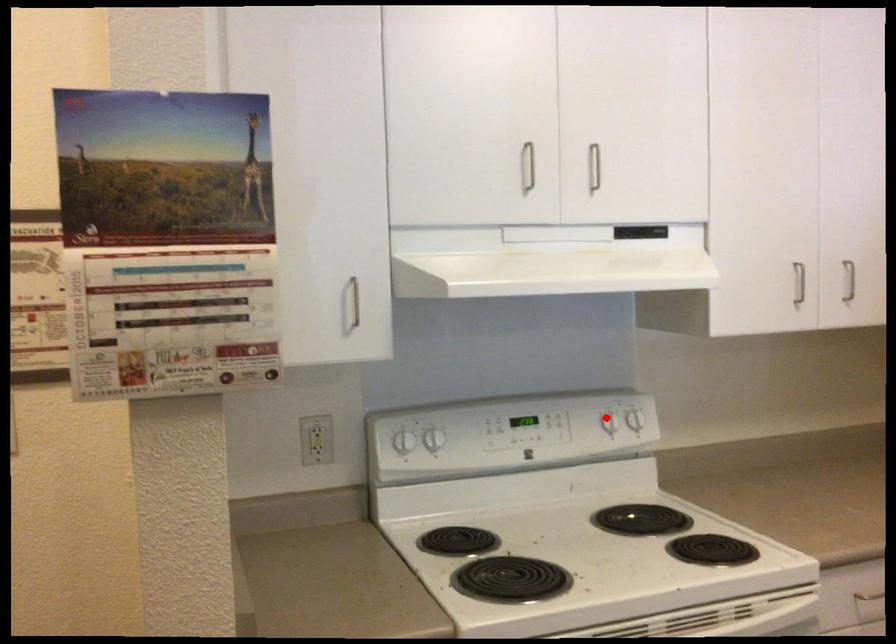
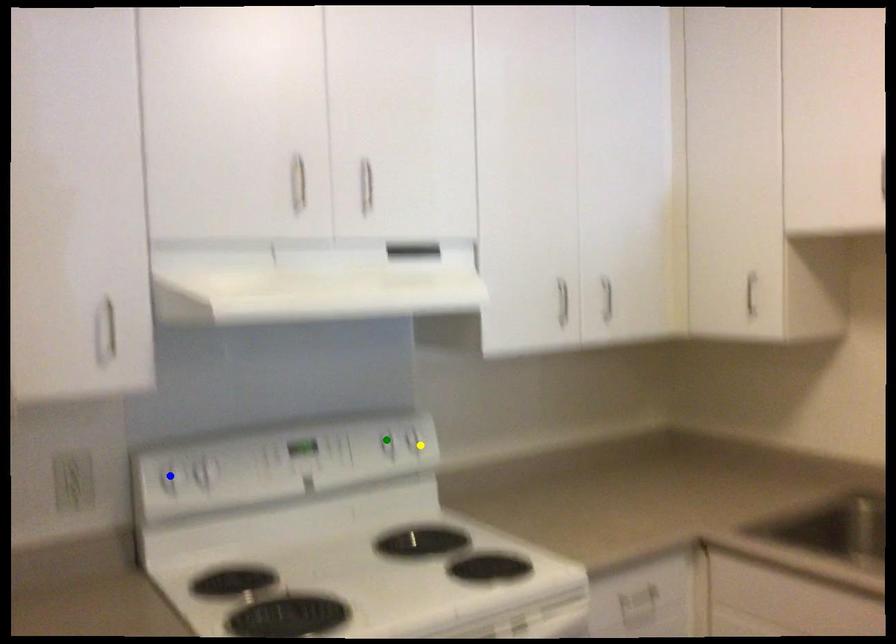
Question: I am providing you with two images of the same scene from different viewpoints. A red point is marked on the first image. You are given multiple points on the second image. Which point in image 2 is actually the same real-world point as the red point in image 1?

Choices:
 (A) yellow point
 (B) blue point
 (C) green point

Answer: (C)